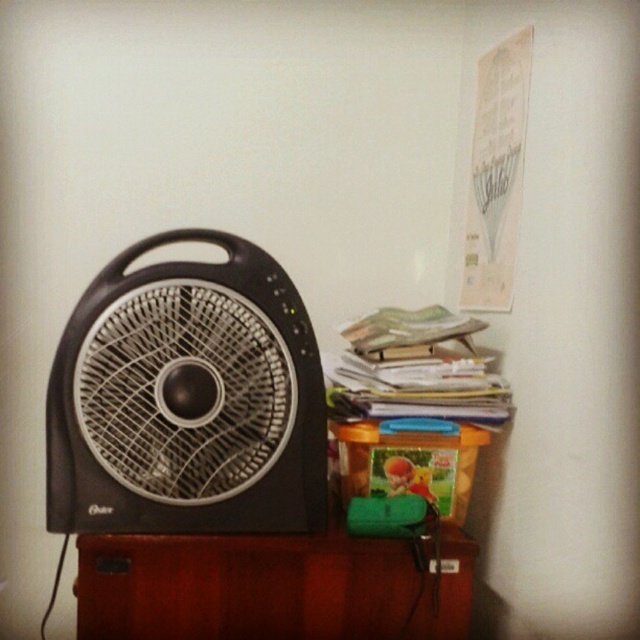
Question: Which object is closer to the camera taking this photo?

Choices:
 (A) brown wood table at lower center
 (B) black plastic fan at left

Answer: (B)

Question: Where is black plastic fan at left located in relation to brown wood table at lower center in the image?

Choices:
 (A) above
 (B) below

Answer: (A)

Question: Which object is closer to the camera taking this photo?

Choices:
 (A) brown wood table at lower center
 (B) black plastic fan at left

Answer: (B)

Question: Considering the relative positions of black plastic fan at left and brown wood table at lower center in the image provided, where is black plastic fan at left located with respect to brown wood table at lower center?

Choices:
 (A) left
 (B) right

Answer: (A)

Question: Is black plastic fan at left to the right of brown wood table at lower center from the viewer's perspective?

Choices:
 (A) yes
 (B) no

Answer: (B)